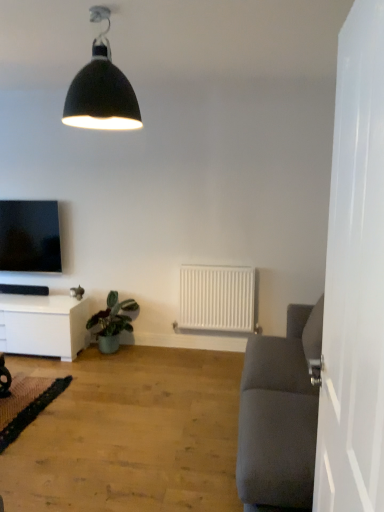
Where is `free spot above wooden floor at lower left (from a real-world perspective)`? The height and width of the screenshot is (512, 384). free spot above wooden floor at lower left (from a real-world perspective) is located at coordinates pos(89,415).